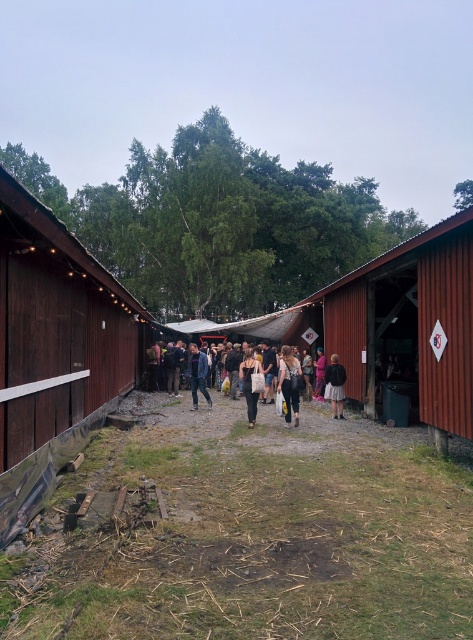
Can you confirm if brushed wood barn at left is positioned above denim pants at center?

Correct, brushed wood barn at left is located above denim pants at center.

The image size is (473, 640). What do you see at coordinates (54, 349) in the screenshot?
I see `brushed wood barn at left` at bounding box center [54, 349].

Between point (43, 316) and point (283, 364), which one is positioned in front?

Point (43, 316) is more forward.

Where is `brushed wood barn at left`? This screenshot has width=473, height=640. brushed wood barn at left is located at coordinates (54, 349).

Which is more to the right, matte black backpack at center or dark brown leather jacket at center?

dark brown leather jacket at center

Which of these two, matte black backpack at center or dark brown leather jacket at center, stands taller?

matte black backpack at center

Is point (342, 404) positioned before point (315, 397)?

That is True.

Where is `matte black backpack at center`? matte black backpack at center is located at coordinates (334, 385).

In the scene shown: Who is more distant from viewer, (24, 243) or (201, 388)?

Point (201, 388)

In the scene shown: Does brushed wood barn at left have a lesser width compared to blue denim jacket at center?

In fact, brushed wood barn at left might be wider than blue denim jacket at center.

Is point (35, 216) more distant than point (204, 381)?

No, it is not.

Locate an element on the screen. Image resolution: width=473 pixels, height=640 pixels. brushed wood barn at left is located at coordinates (54, 349).